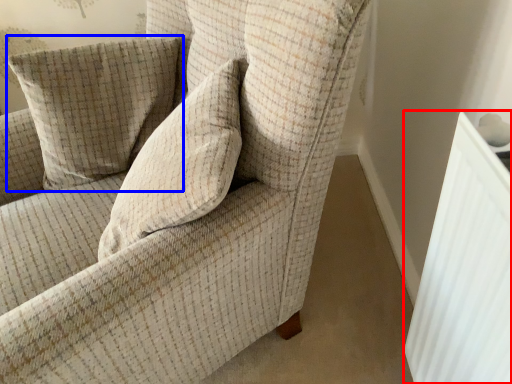
Question: Which of the following is the farthest to the observer, radiator (highlighted by a red box) or pillow (highlighted by a blue box)?

Choices:
 (A) radiator
 (B) pillow

Answer: (B)